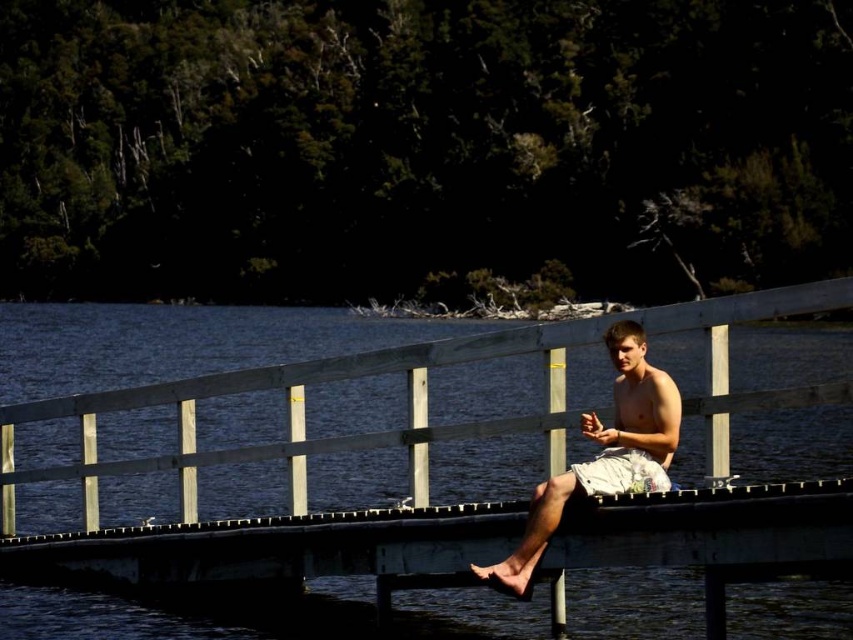
You are a swimmer who wants to jump into the water. You see the blue water at center and the light beige shorts at center. Which one is bigger in size?

The blue water at center is larger in size compared to the light beige shorts at center.

You are standing on the wooden dock and want to step into the blue water at center. Which direction should you move relative to your current position near the white cotton shorts at center?

The blue water at center is to the left of white cotton shorts at center, so you should move to your left to step into the blue water at center.